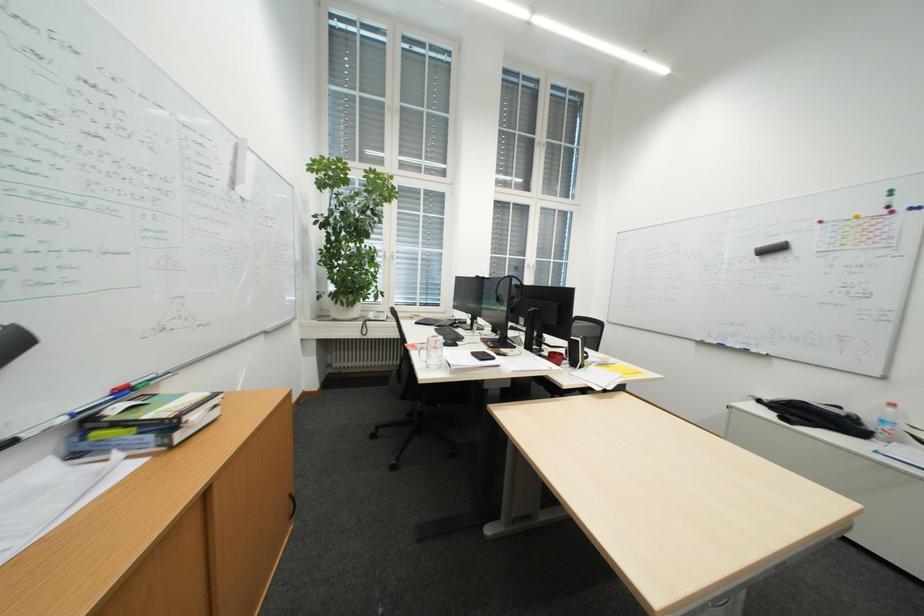
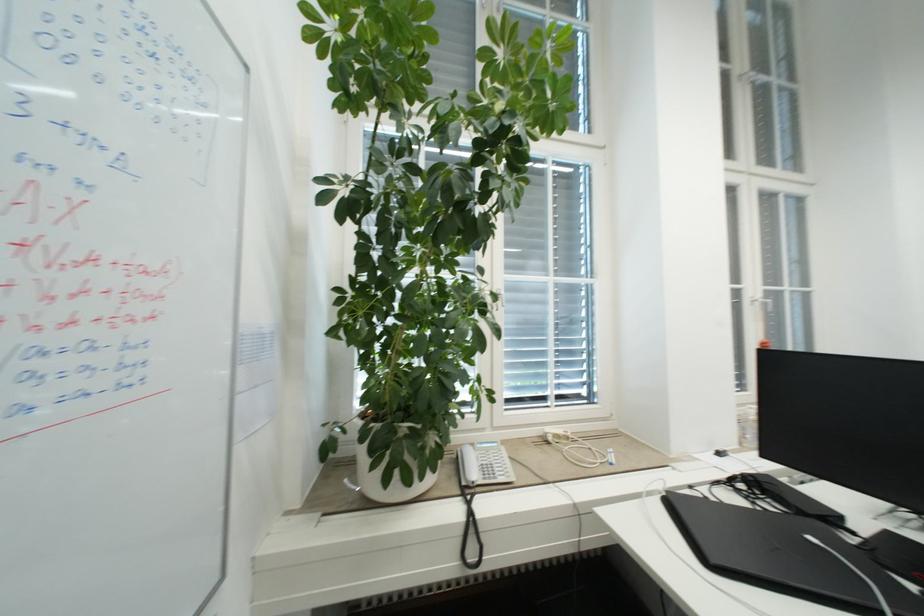
Which direction would the cameraman need to move to produce the second image?

The cameraman moved toward left, forward.